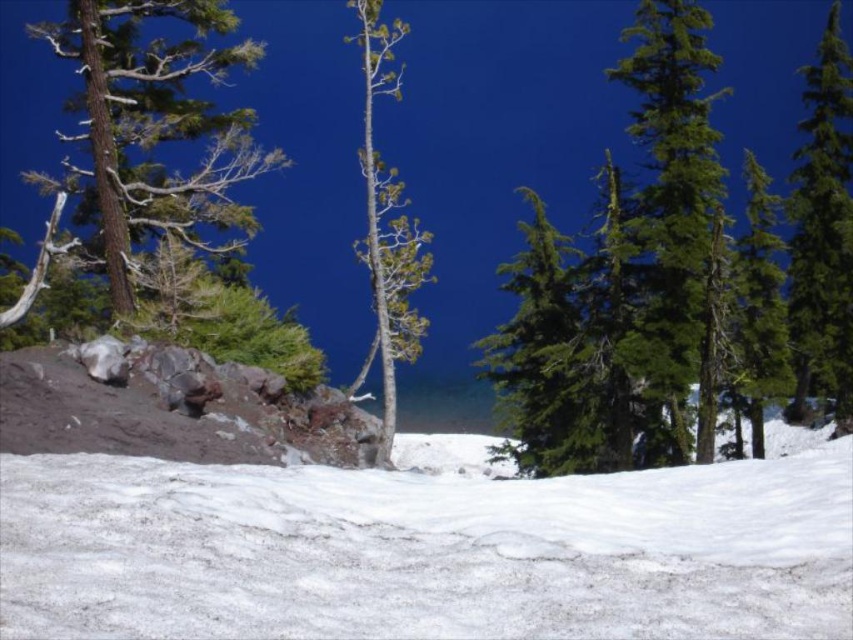
Question: Is brown rough bark tree at left smaller than green glossy tree at right?

Choices:
 (A) no
 (B) yes

Answer: (B)

Question: Can you confirm if white snow at center is positioned below green textured tree at right?

Choices:
 (A) yes
 (B) no

Answer: (A)

Question: Estimate the real-world distances between objects in this image. Which object is closer to the white snow at center?

Choices:
 (A) green glossy tree at right
 (B) brown rough bark tree at left

Answer: (B)

Question: Estimate the real-world distances between objects in this image. Which object is closer to the green glossy tree at right?

Choices:
 (A) green textured tree at right
 (B) brown rough bark tree at left
 (C) white snow at center

Answer: (A)

Question: Which point is closer to the camera taking this photo?

Choices:
 (A) (213, 124)
 (B) (706, 256)

Answer: (B)

Question: Does brown rough bark tree at left have a lesser width compared to green textured tree at right?

Choices:
 (A) no
 (B) yes

Answer: (A)